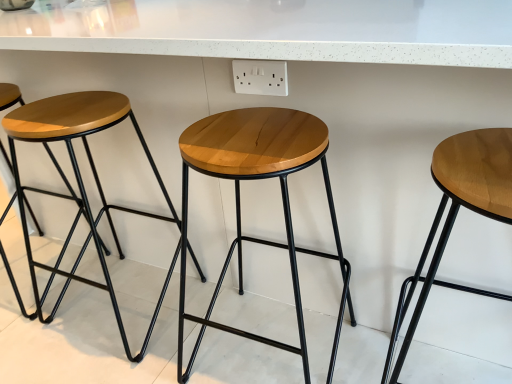
Find the location of a particular element. vacant area on top of light brown wood stool at right, arranged as the 4th stool when viewed from the left (from a real-world perspective) is located at coordinates (477, 163).